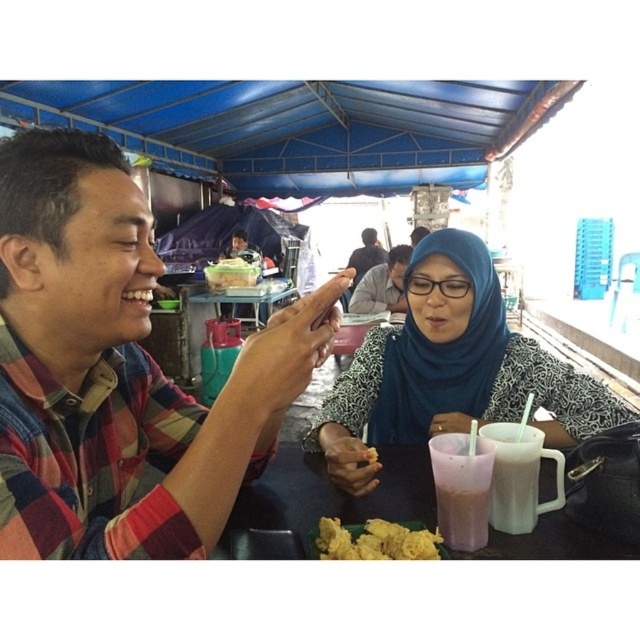
Does matte white mug at lower right appear on the right side of yellow fried food at lower center?

Indeed, matte white mug at lower right is positioned on the right side of yellow fried food at lower center.

Does matte white mug at lower right appear under yellow fried food at lower center?

Actually, matte white mug at lower right is above yellow fried food at lower center.

Identify the location of matte white mug at lower right. The image size is (640, 640). (518, 476).

Where is `matte white mug at lower right`? The height and width of the screenshot is (640, 640). matte white mug at lower right is located at coordinates pos(518,476).

Does plaid fabric shirt at center have a larger size compared to dark blue fabric headscarf at center?

No, plaid fabric shirt at center is not bigger than dark blue fabric headscarf at center.

Who is taller, plaid fabric shirt at center or dark blue fabric headscarf at center?

Standing taller between the two is dark blue fabric headscarf at center.

Between point (97, 248) and point (353, 262), which one is positioned in front?

Point (97, 248) is more forward.

You are a GUI agent. You are given a task and a screenshot of the screen. Output one action in this format:
    pyautogui.click(x=<x>, y=<y>)
    Task: Click on the plaid fabric shirt at center
    
    Given the screenshot: What is the action you would take?
    pyautogui.click(x=118, y=371)

Who is higher up, pink plastic table at lower center or yellow fried food at lower center?

yellow fried food at lower center is above.

Where is `pink plastic table at lower center`? The width and height of the screenshot is (640, 640). pink plastic table at lower center is located at coordinates (332, 493).

Where is `pink plastic table at lower center`? The width and height of the screenshot is (640, 640). pink plastic table at lower center is located at coordinates click(x=332, y=493).